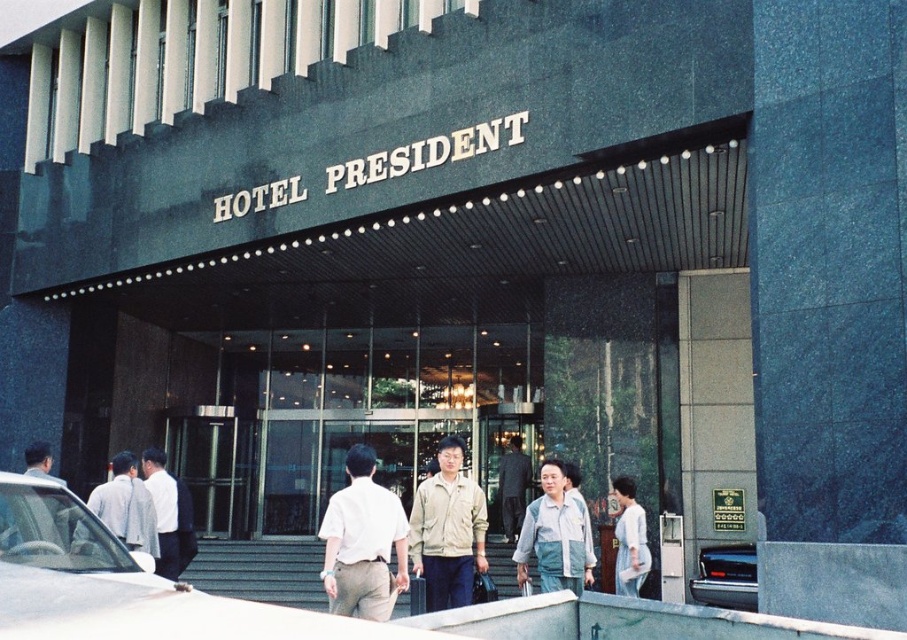
You are standing in front of the Hotel President entrance. You see a white cotton shirt at center. If you want to take a photo of the shirt from where you are standing, will you need to zoom in or zoom out?

The white cotton shirt at center is 4.98 meters away from you. Since the distance is relatively far, you would need to zoom in to capture a clear image of the shirt.

You are standing at the entrance of Hotel President and notice two people wearing shirts. One is wearing a light gray cotton shirt at left and the other a white matte shirt at center. From your perspective, which shirt is higher in position?

The light gray cotton shirt at left is above the white matte shirt at center, so the light gray cotton shirt at left is higher in position.